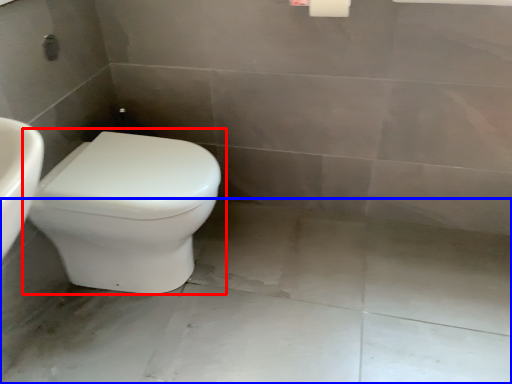
Question: Which object appears farthest to the camera in this image, toilet (highlighted by a red box) or concrete (highlighted by a blue box)?

Choices:
 (A) toilet
 (B) concrete

Answer: (A)